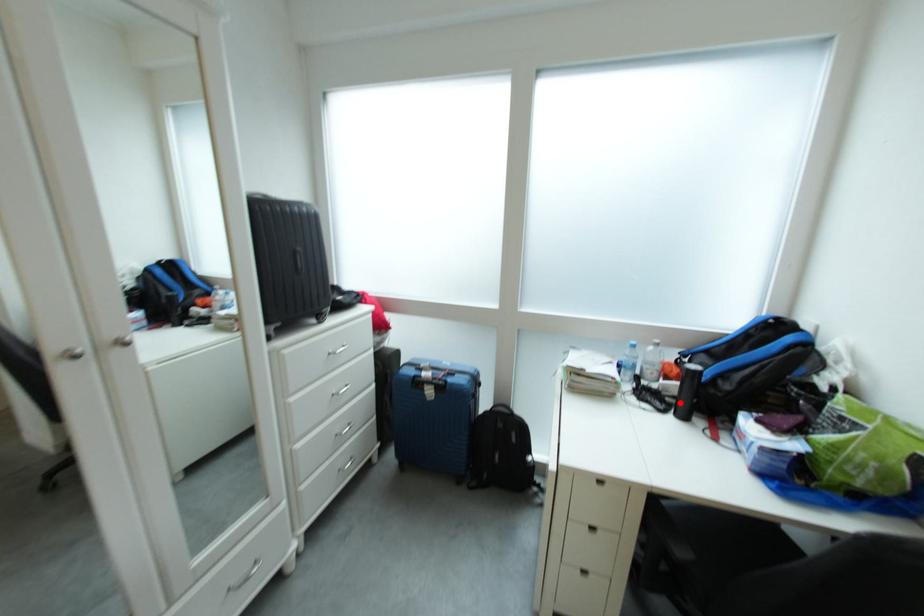
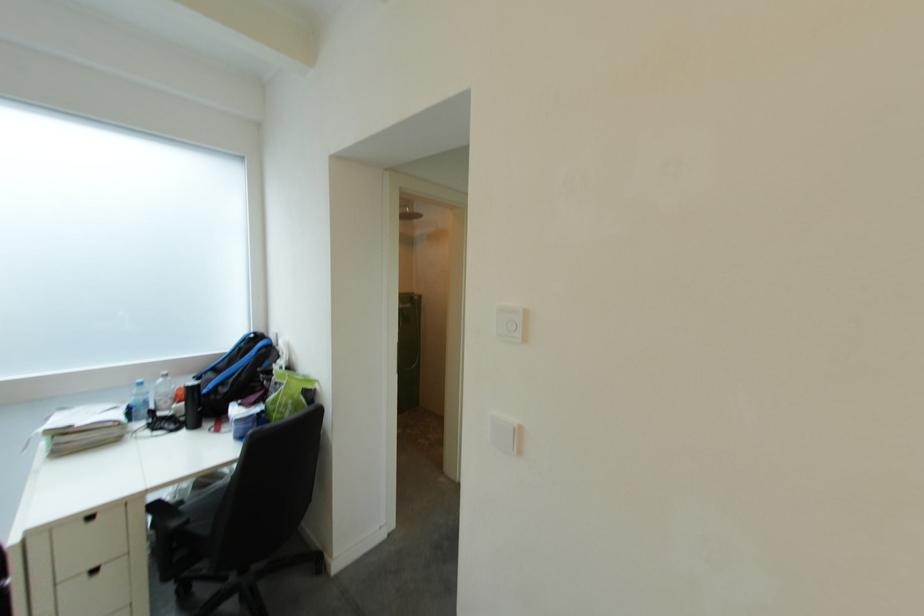
Locate, in the second image, the point that corresponds to the highlighted location in the first image.

(195, 422)